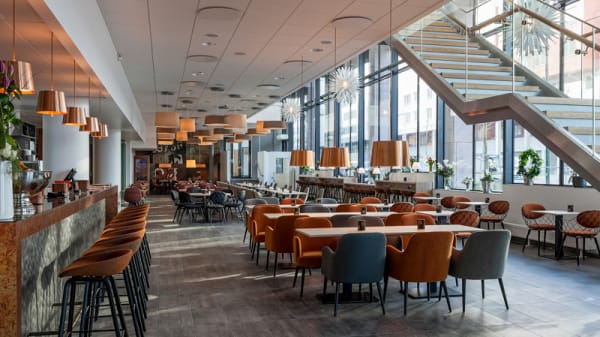
In order to click on tables in this screenshot , I will do `click(350, 230)`, `click(326, 211)`, `click(329, 204)`, `click(554, 212)`, `click(471, 202)`, `click(431, 196)`, `click(282, 188)`, `click(253, 185)`, `click(204, 190)`, `click(196, 183)`.